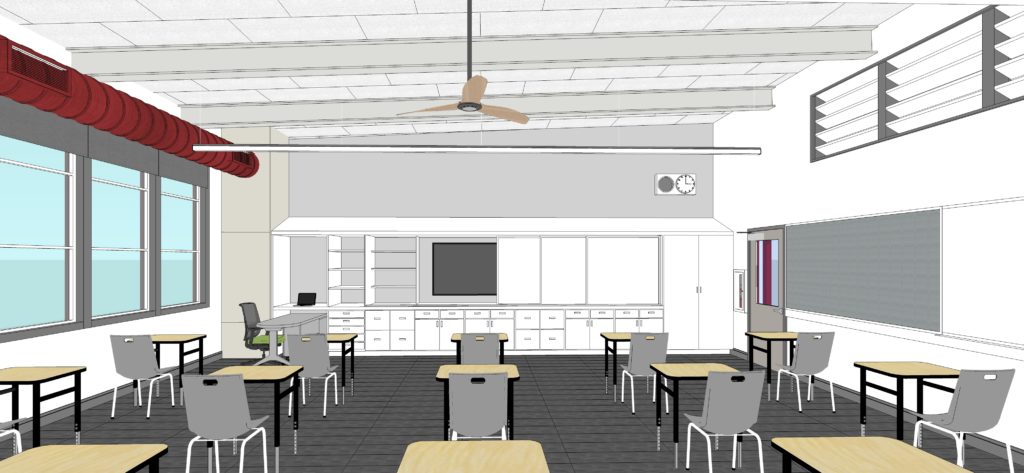
Where is `window`? window is located at coordinates (44, 274), (38, 215), (120, 222), (167, 288), (132, 277), (166, 212).